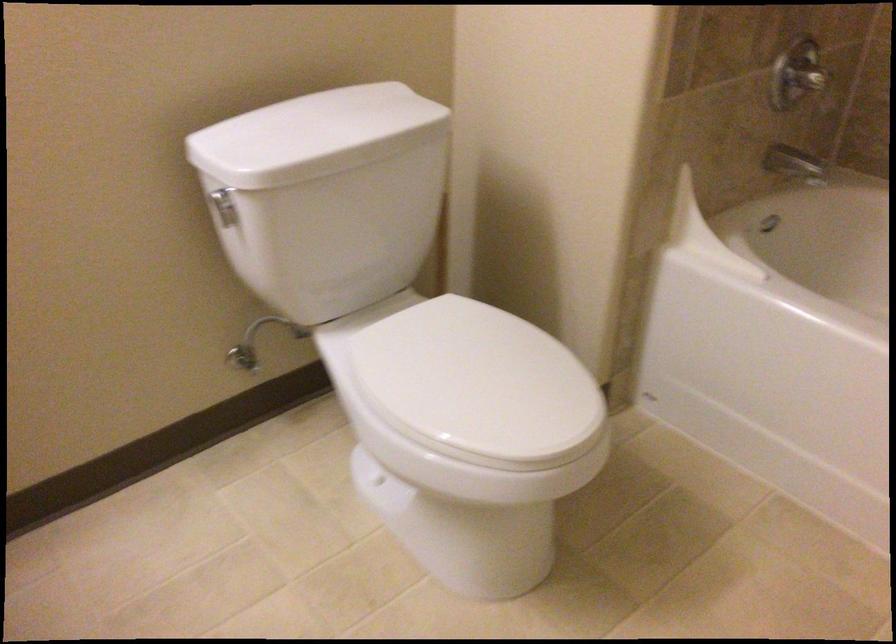
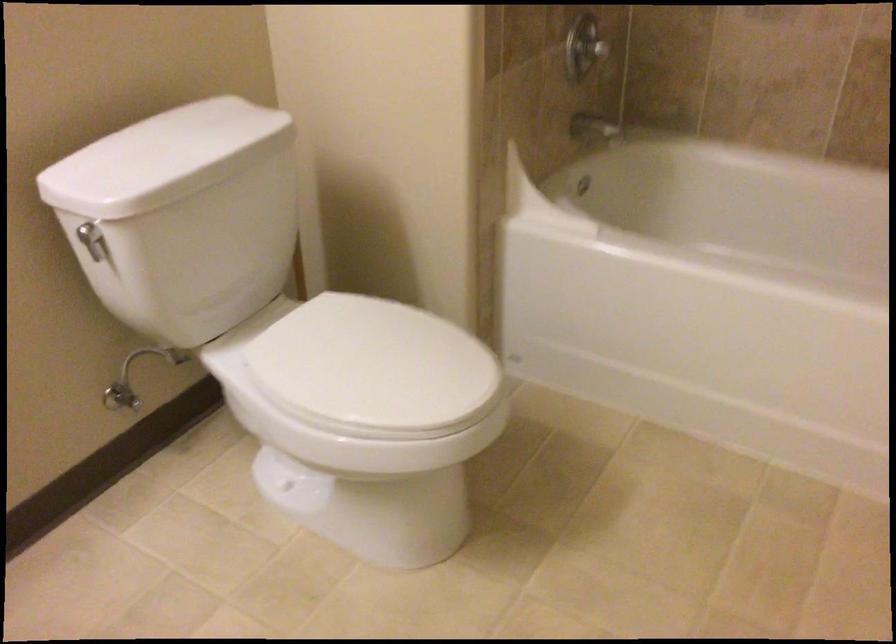
Question: How did the camera likely rotate?

Choices:
 (A) Left
 (B) Right
 (C) Up
 (D) Down

Answer: (B)